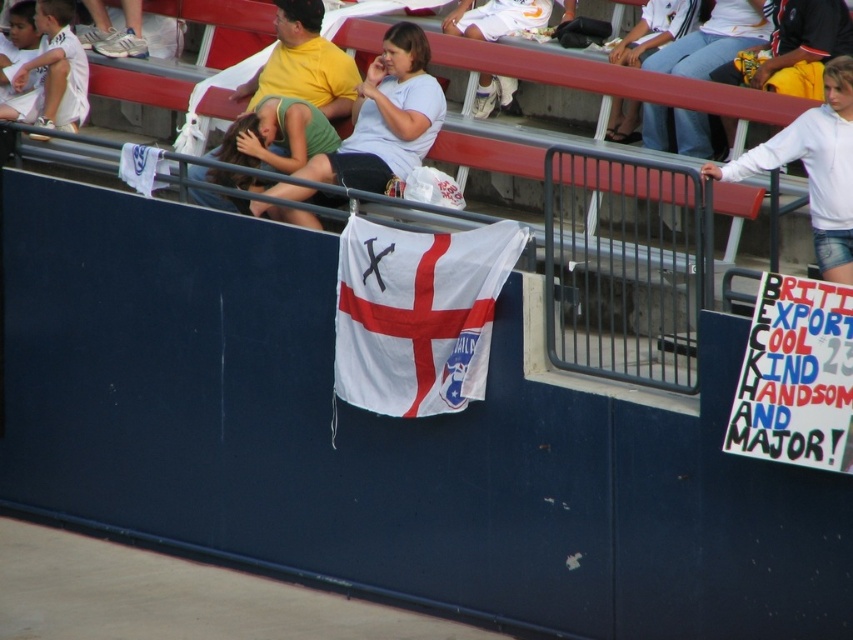
Question: Which object is the closest to the yellow cotton shirt at upper center?

Choices:
 (A) denim shorts at upper right
 (B) white cotton shirt at upper center

Answer: (B)

Question: Which point appears closest to the camera in this image?

Choices:
 (A) (822, 164)
 (B) (291, 196)
 (C) (381, 404)

Answer: (A)

Question: Is white jersey at upper left below denim shorts at upper right?

Choices:
 (A) yes
 (B) no

Answer: (A)

Question: Observing the image, what is the correct spatial positioning of white cotton shirt at upper right in reference to yellow cotton shirt at upper center?

Choices:
 (A) left
 (B) right

Answer: (B)

Question: Among these objects, which one is nearest to the camera?

Choices:
 (A) white fabric flag at center
 (B) yellow cotton shirt at upper center

Answer: (A)

Question: Does white fabric flag at center appear on the left side of denim shorts at upper right?

Choices:
 (A) yes
 (B) no

Answer: (A)